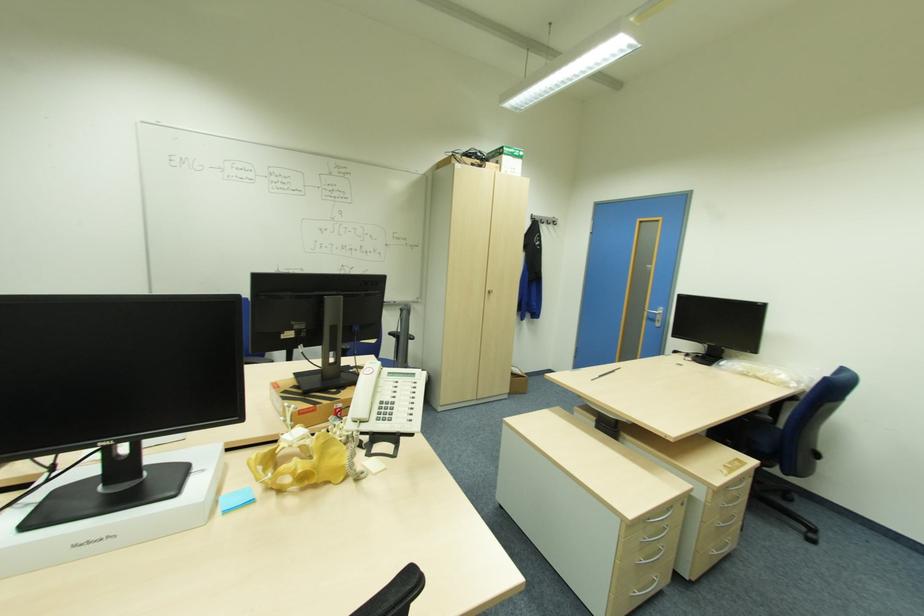
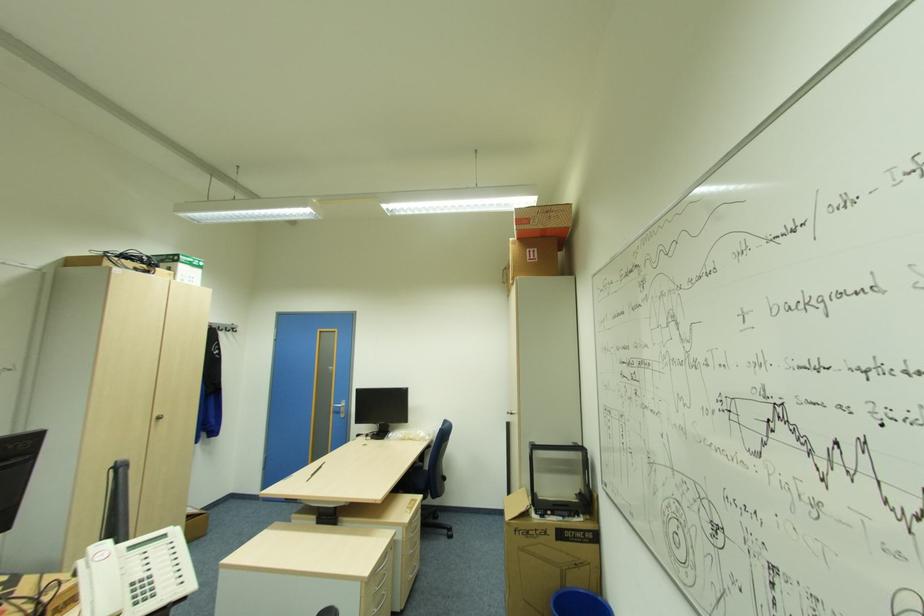
Question: The camera is either moving clockwise (left) or counter-clockwise (right) around the object. The first image is from the beginning of the video and the second image is from the end. Is the camera moving left or right when shooting the video?

Choices:
 (A) Left
 (B) Right

Answer: (A)